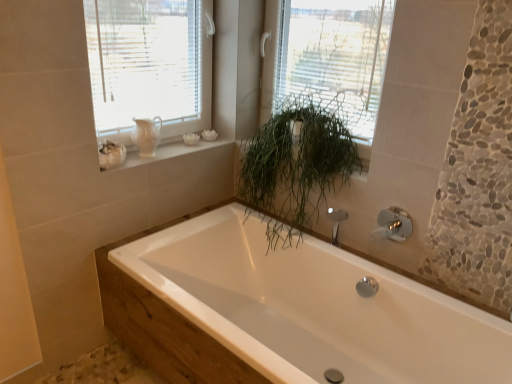
Question: From a real-world perspective, is matte white pitcher at upper left physically located above or below chrome metallic faucet at upper right?

Choices:
 (A) below
 (B) above

Answer: (B)

Question: Is matte white pitcher at upper left bigger or smaller than chrome metallic faucet at upper right?

Choices:
 (A) big
 (B) small

Answer: (A)

Question: Considering the real-world distances, which object is closest to the matte white pitcher at upper left?

Choices:
 (A) white ceramic vase at upper left
 (B) white glossy bathtub at center
 (C) green leafy plant at upper center
 (D) chrome metallic faucet at upper right
 (E) green leafy plant at center

Answer: (A)

Question: Based on their relative distances, which object is farther from the matte white pitcher at upper left?

Choices:
 (A) white ceramic vase at upper left
 (B) white glossy bathtub at center
 (C) green leafy plant at upper center
 (D) chrome metallic faucet at upper right
 (E) green leafy plant at center

Answer: (D)